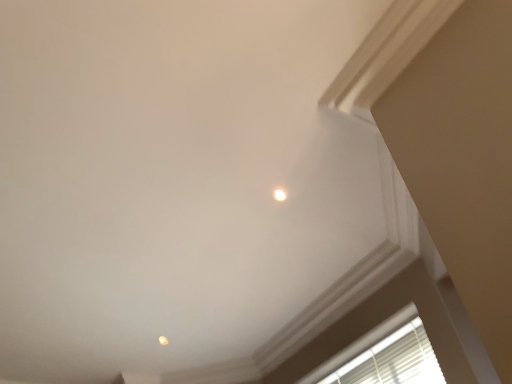
What do you see at coordinates (386, 355) in the screenshot?
I see `white blinds at lower right` at bounding box center [386, 355].

Where is `white glossy light fixture at upper center, the second dot when ordered from left to right`? white glossy light fixture at upper center, the second dot when ordered from left to right is located at coordinates (279, 194).

The height and width of the screenshot is (384, 512). Identify the location of matte orange light at upper center, acting as the 2th dot starting from the front. (163, 340).

From a real-world perspective, who is located lower, matte orange light at upper center, marked as the 1th dot in a left-to-right arrangement, or white blinds at lower right?

From a 3D spatial view, white blinds at lower right is below.

Between matte orange light at upper center, acting as the 2th dot starting from the front, and white blinds at lower right, which one is positioned in front?

white blinds at lower right is in front.

Could you tell me if matte orange light at upper center, acting as the 2th dot starting from the front, is turned towards white blinds at lower right?

No, matte orange light at upper center, acting as the 2th dot starting from the front, is not oriented towards white blinds at lower right.

Which object is positioned more to the right, matte orange light at upper center, marked as the second dot in a top-to-bottom arrangement, or white blinds at lower right?

white blinds at lower right.

Locate an element on the screen. The width and height of the screenshot is (512, 384). dot behind the white glossy light fixture at upper center, the 2th dot viewed from the back is located at coordinates (163, 340).

In the image, is matte orange light at upper center, arranged as the 1th dot when ordered from the bottom, positioned in front of or behind white glossy light fixture at upper center, the 2th dot viewed from the back?

matte orange light at upper center, arranged as the 1th dot when ordered from the bottom, is behind white glossy light fixture at upper center, the 2th dot viewed from the back.

From the image's perspective, does matte orange light at upper center, acting as the 2th dot starting from the front, appear higher than white glossy light fixture at upper center, which appears as the first dot when viewed from the front?

No, from the image's perspective, matte orange light at upper center, acting as the 2th dot starting from the front, is not over white glossy light fixture at upper center, which appears as the first dot when viewed from the front.

In the scene shown: Does matte orange light at upper center, placed as the second dot when sorted from right to left, have a smaller size compared to white glossy light fixture at upper center, the second dot when ordered from left to right?

Incorrect, matte orange light at upper center, placed as the second dot when sorted from right to left, is not smaller in size than white glossy light fixture at upper center, the second dot when ordered from left to right.

Does white blinds at lower right have a larger size compared to matte orange light at upper center, placed as the second dot when sorted from right to left?

Yes.

Does white blinds at lower right touch matte orange light at upper center, marked as the second dot in a top-to-bottom arrangement?

There is a gap between white blinds at lower right and matte orange light at upper center, marked as the second dot in a top-to-bottom arrangement.

In terms of width, does white blinds at lower right look wider or thinner when compared to matte orange light at upper center, marked as the 1th dot in a left-to-right arrangement?

Considering their sizes, white blinds at lower right looks broader than matte orange light at upper center, marked as the 1th dot in a left-to-right arrangement.

Considering the points (353, 372) and (167, 343), which point is behind, point (353, 372) or point (167, 343)?

The point (167, 343) is behind.

Identify the location of the 1st dot counting from the left of the white blinds at lower right. Image resolution: width=512 pixels, height=384 pixels. (279, 194).

Looking at this image, is white blinds at lower right wider or thinner than white glossy light fixture at upper center, the 2th dot viewed from the back?

Clearly, white blinds at lower right has more width compared to white glossy light fixture at upper center, the 2th dot viewed from the back.

From the image's perspective, which is below, white blinds at lower right or white glossy light fixture at upper center, the second dot ordered from the bottom?

white blinds at lower right.

Is white blinds at lower right far from white glossy light fixture at upper center, the 2th dot viewed from the back?

That's right, there is a large distance between white blinds at lower right and white glossy light fixture at upper center, the 2th dot viewed from the back.

Considering the positions of points (281, 198) and (416, 336), is point (281, 198) closer to camera compared to point (416, 336)?

Yes, point (281, 198) is in front of point (416, 336).

From the image's perspective, who appears lower, white glossy light fixture at upper center, the second dot when ordered from left to right, or white blinds at lower right?

white blinds at lower right appears lower in the image.

Are white glossy light fixture at upper center, which is counted as the 1th dot, starting from the top, and white blinds at lower right making contact?

No, white glossy light fixture at upper center, which is counted as the 1th dot, starting from the top, is not touching white blinds at lower right.

Is white blinds at lower right surrounded by white glossy light fixture at upper center, the second dot when ordered from left to right?

That's incorrect, white blinds at lower right is not inside white glossy light fixture at upper center, the second dot when ordered from left to right.

Consider the image. Between white glossy light fixture at upper center, the second dot when ordered from left to right, and matte orange light at upper center, acting as the 2th dot starting from the front, which one has smaller size?

Smaller between the two is white glossy light fixture at upper center, the second dot when ordered from left to right.

Find the location of a particular element. dot lying below the white glossy light fixture at upper center, the second dot ordered from the bottom (from the image's perspective) is located at coordinates (163, 340).

Which is behind, white glossy light fixture at upper center, placed as the first dot when sorted from right to left, or matte orange light at upper center, marked as the second dot in a top-to-bottom arrangement?

matte orange light at upper center, marked as the second dot in a top-to-bottom arrangement, is further away from the camera.

From a real-world perspective, count 1st dots upward from the white blinds at lower right and point to it. Please provide its 2D coordinates.

[(163, 340)]

Where is `dot that appears below the white glossy light fixture at upper center, the 2th dot viewed from the back (from the image's perspective)`? The image size is (512, 384). dot that appears below the white glossy light fixture at upper center, the 2th dot viewed from the back (from the image's perspective) is located at coordinates (163, 340).

Looking at the image, which one is located further to matte orange light at upper center, placed as the second dot when sorted from right to left, white blinds at lower right or white glossy light fixture at upper center, the second dot when ordered from left to right?

The object further to matte orange light at upper center, placed as the second dot when sorted from right to left, is white glossy light fixture at upper center, the second dot when ordered from left to right.

Estimate the real-world distances between objects in this image. Which object is further from white blinds at lower right, white glossy light fixture at upper center, which appears as the first dot when viewed from the front, or matte orange light at upper center, marked as the 1th dot in a left-to-right arrangement?

matte orange light at upper center, marked as the 1th dot in a left-to-right arrangement, lies further to white blinds at lower right than the other object.

From the picture: When comparing their distances from white glossy light fixture at upper center, the 2th dot viewed from the back, does white blinds at lower right or matte orange light at upper center, acting as the 2th dot starting from the front, seem closer?

white blinds at lower right lies closer to white glossy light fixture at upper center, the 2th dot viewed from the back, than the other object.

Based on their spatial positions, is white glossy light fixture at upper center, which is counted as the 1th dot, starting from the top, or white blinds at lower right closer to matte orange light at upper center, arranged as the 1th dot when ordered from the bottom?

white blinds at lower right is positioned closer to the anchor matte orange light at upper center, arranged as the 1th dot when ordered from the bottom.

In the scene shown: Based on their spatial positions, is matte orange light at upper center, marked as the second dot in a top-to-bottom arrangement, or white glossy light fixture at upper center, the second dot when ordered from left to right, closer to white blinds at lower right?

white glossy light fixture at upper center, the second dot when ordered from left to right, is positioned closer to the anchor white blinds at lower right.

Estimate the real-world distances between objects in this image. Which object is further from white glossy light fixture at upper center, placed as the first dot when sorted from right to left, matte orange light at upper center, marked as the second dot in a top-to-bottom arrangement, or white blinds at lower right?

Among the two, matte orange light at upper center, marked as the second dot in a top-to-bottom arrangement, is located further to white glossy light fixture at upper center, placed as the first dot when sorted from right to left.

The image size is (512, 384). What are the coordinates of `dot between matte orange light at upper center, arranged as the 1th dot when ordered from the bottom, and white blinds at lower right, in the horizontal direction` in the screenshot? It's located at (279, 194).